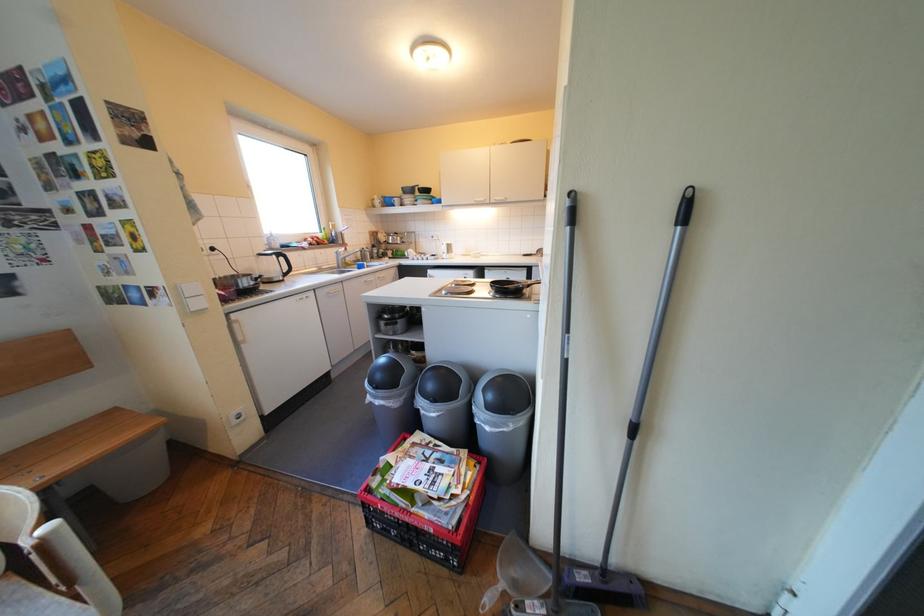
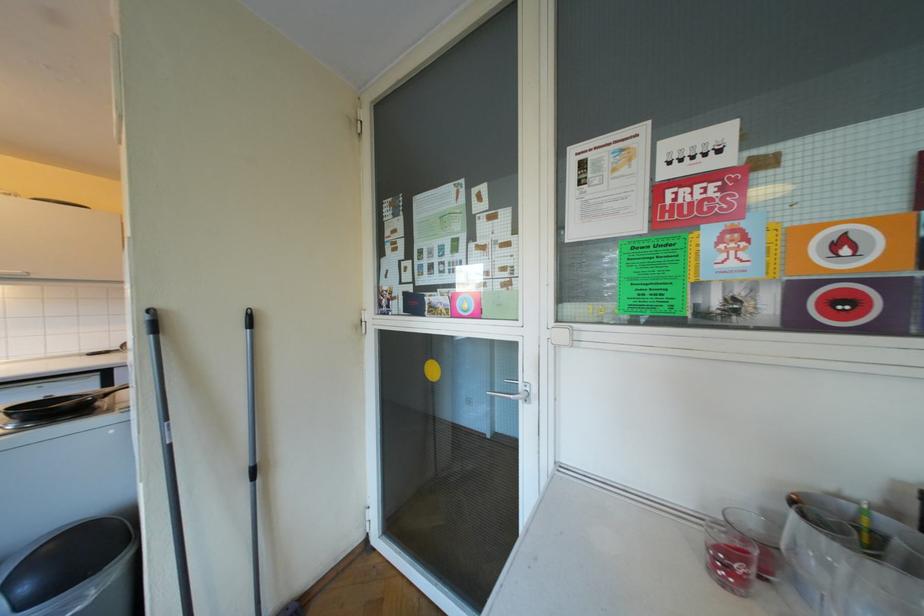
Find the pixel in the second image that matches point (503, 406) in the first image.

(40, 602)